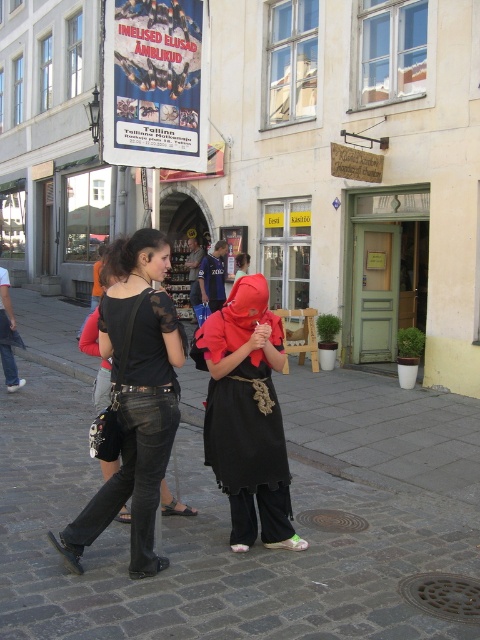
You are a photographer standing in the middle of the cobblestone street. You want to take a photo of the matte red fabric at center and the matte black dress at center. Which object is positioned to the right side of the other?

The matte red fabric at center is to the right of the matte black dress at center.

You are a street performer who needs to place a large prop on the cobblestone pavement at center and the matte red fabric at center. Which surface can accommodate the prop better?

The cobblestone pavement at center is bigger than the matte red fabric at center, so it can accommodate the prop better.